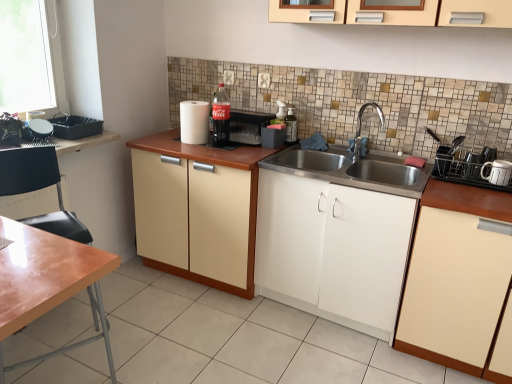
What are the coordinates of `free space to the left of white ceramic mug at right, the first appliance when ordered from right to left` in the screenshot? It's located at (461, 183).